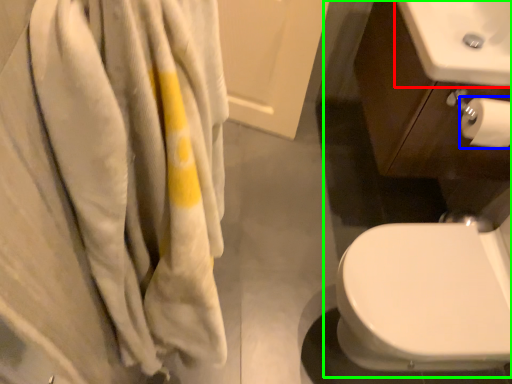
Question: Considering the real-world distances, which object is closest to sink (highlighted by a red box)? toilet paper (highlighted by a blue box) or sink (highlighted by a green box).

Choices:
 (A) toilet paper
 (B) sink

Answer: (B)